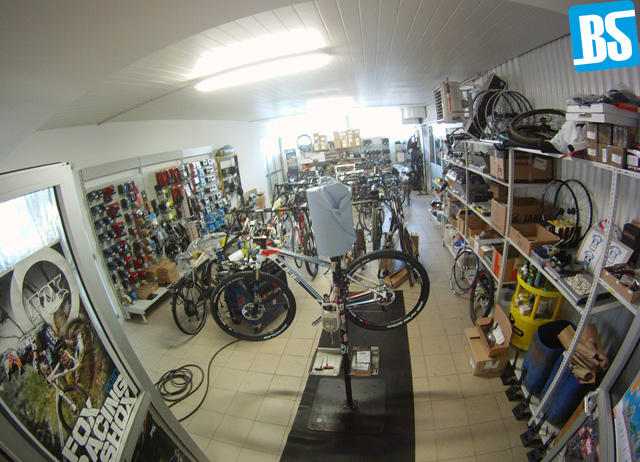
The height and width of the screenshot is (462, 640). I want to click on cable, so [x=187, y=384].